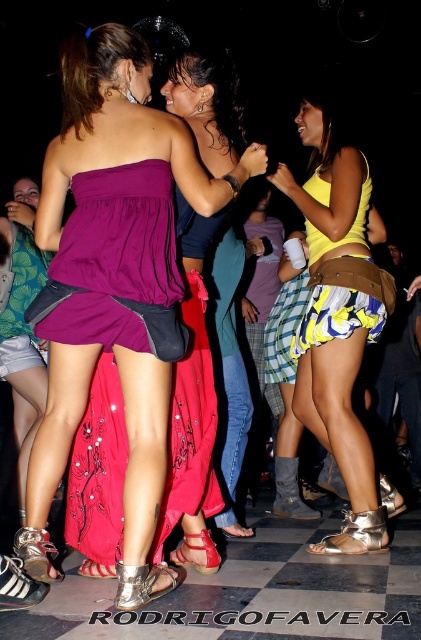
You are a photographer positioned at the origin point of the coordinate system. You want to capture a photo of the purple satin dress at center. What are the coordinates where you should aim your camera?

The coordinates to aim your camera are at point (117, 266) to capture the purple satin dress at center.

You are a photographer at the nightclub and want to capture a photo of both the purple satin dress at center and the shiny purple dress at center. Which dress should you focus on first to ensure it appears sharp in the photo?

The purple satin dress at center is closer to the viewer than the shiny purple dress at center, so you should focus on the purple satin dress at center first to ensure it appears sharp in the photo.